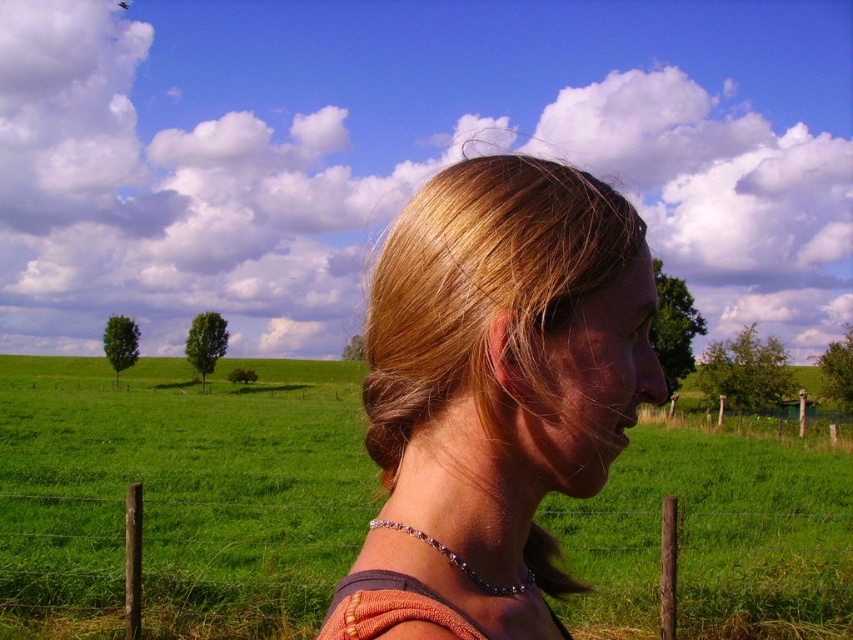
Between blonde hair at center and wooden post at lower right, which one is positioned higher?

Positioned higher is blonde hair at center.

Between blonde hair at center and wooden post at lower right, which one appears on the right side from the viewer's perspective?

Positioned to the right is wooden post at lower right.

What are the coordinates of `blonde hair at center` in the screenshot? It's located at point(498,380).

Where is `blonde hair at center`? The image size is (853, 640). blonde hair at center is located at coordinates (498, 380).